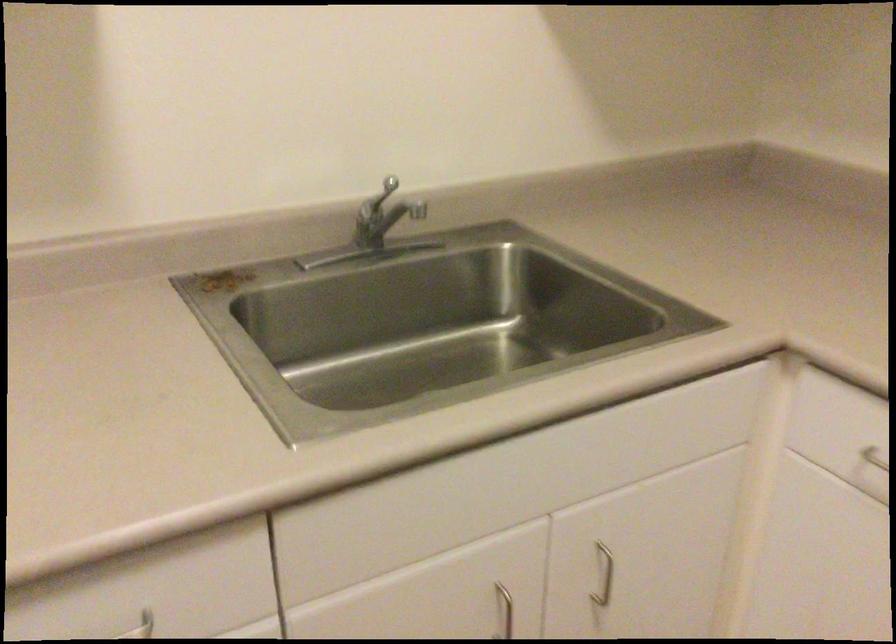
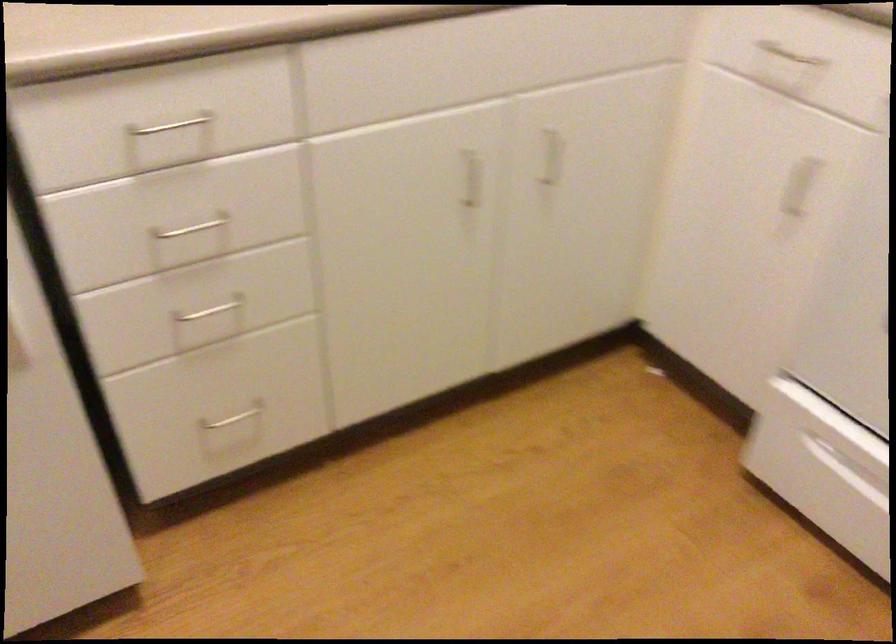
Question: The images are taken continuously from a first-person perspective. In which direction are you moving?

Choices:
 (A) Left
 (B) Right
 (C) Forward
 (D) Backward

Answer: (D)